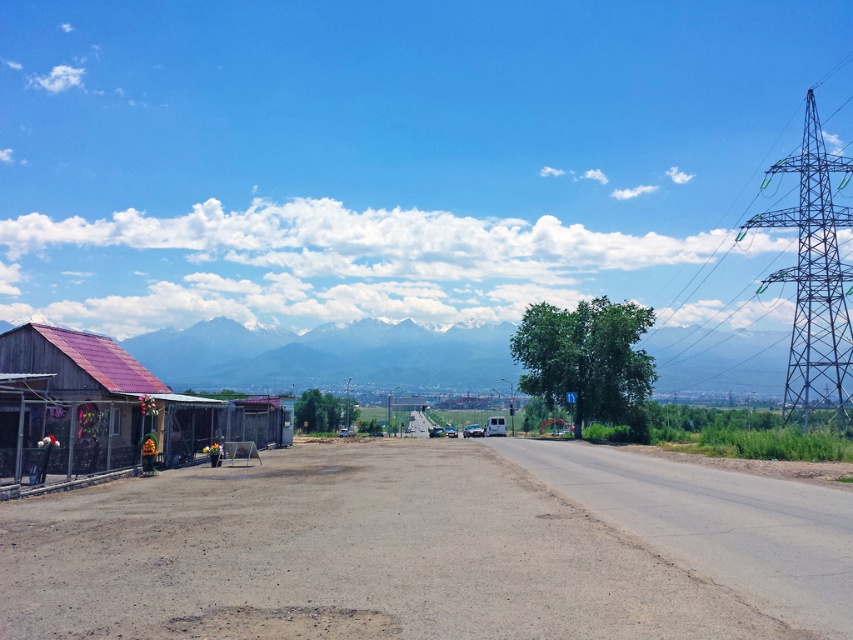
You are standing at the center of the image and want to walk to the dusty asphalt road at lower left. Which direction should you move in?

Since the dusty asphalt road at lower left is located at point (431,548), you should move towards the lower left direction to reach it.